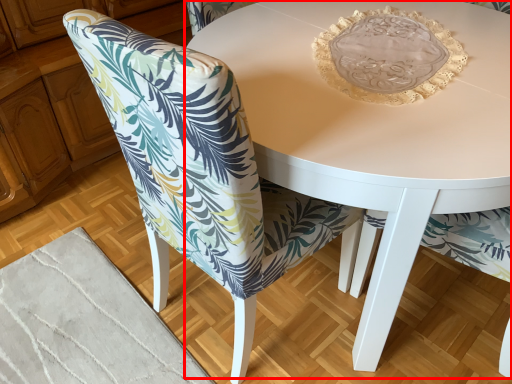
Question: From the image's perspective, what is the correct spatial positioning of coffee table (annotated by the red box) in reference to chair?

Choices:
 (A) below
 (B) above

Answer: (B)